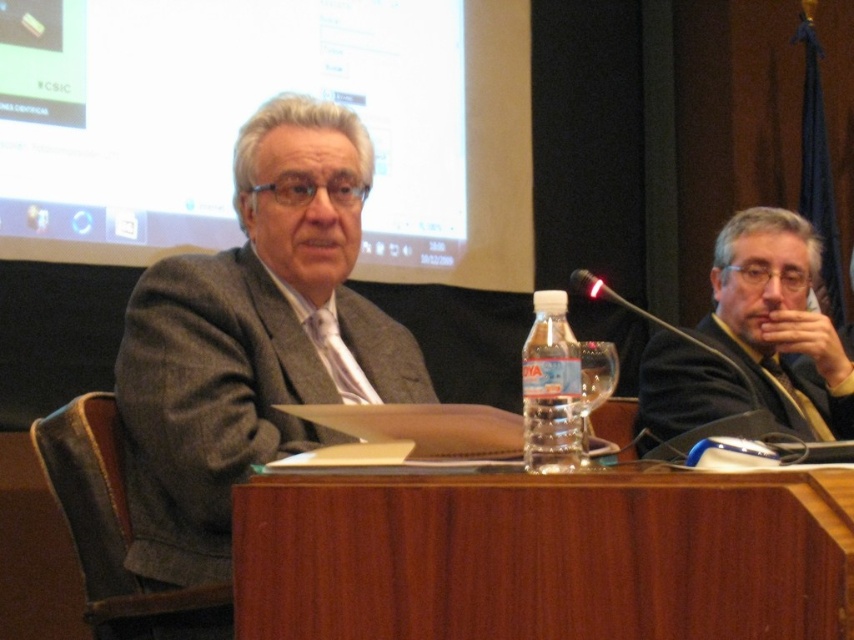
Between point (764, 508) and point (307, 150), which one is positioned in front?

Point (764, 508) is in front.

Does wooden table at center appear under gray wool suit at center?

Yes.

Where is `wooden table at center`? The width and height of the screenshot is (854, 640). wooden table at center is located at coordinates (544, 556).

Is point (662, 515) closer to viewer compared to point (746, 221)?

Yes, it is.

Can you confirm if wooden table at center is shorter than dark gray suit at right?

Correct, wooden table at center is not as tall as dark gray suit at right.

What do you see at coordinates (544, 556) in the screenshot? This screenshot has width=854, height=640. I see `wooden table at center` at bounding box center [544, 556].

This screenshot has height=640, width=854. What are the coordinates of `wooden table at center` in the screenshot? It's located at (544, 556).

Which is above, wooden table at center or translucent plastic bottle at center?

Positioned higher is translucent plastic bottle at center.

This screenshot has width=854, height=640. I want to click on wooden table at center, so (544, 556).